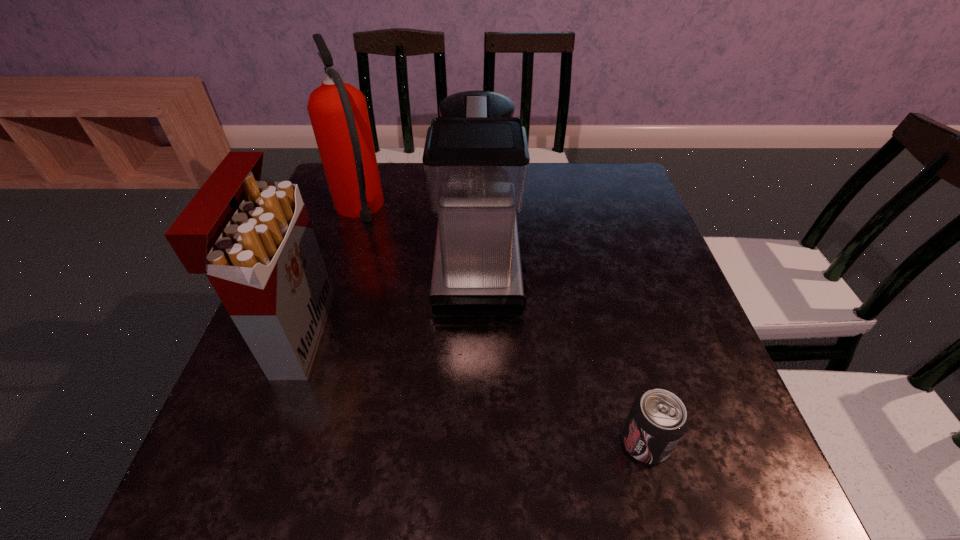
The height and width of the screenshot is (540, 960). In order to click on vacant space situated 0.230m on the left of the shortest object in this screenshot , I will do `click(485, 442)`.

I want to click on object located at the far edge, so click(338, 112).

You are a GUI agent. You are given a task and a screenshot of the screen. Output one action in this format:
    pyautogui.click(x=<x>, y=<y>)
    Task: Click on the object situated at the near edge
    
    Given the screenshot: What is the action you would take?
    pyautogui.click(x=657, y=420)

Locate an element on the screen. fire extinguisher at the left edge is located at coordinates [x=338, y=112].

You are a GUI agent. You are given a task and a screenshot of the screen. Output one action in this format:
    pyautogui.click(x=<x>, y=<y>)
    Task: Click on the cigarette case at the left edge
    This screenshot has width=960, height=540.
    Given the screenshot: What is the action you would take?
    pyautogui.click(x=254, y=240)

This screenshot has height=540, width=960. Identify the location of object that is at the right edge. (657, 420).

Locate an element on the screen. object positioned at the far left corner is located at coordinates (338, 112).

You are a GUI agent. You are given a task and a screenshot of the screen. Output one action in this format:
    pyautogui.click(x=<x>, y=<y>)
    Task: Click on the object positioned at the near right corner
    This screenshot has height=540, width=960.
    Given the screenshot: What is the action you would take?
    pyautogui.click(x=657, y=420)

Locate an element on the screen. The image size is (960, 540). free space at the far edge of the desktop is located at coordinates (576, 186).

Where is `blank space at the near edge of the desktop`? blank space at the near edge of the desktop is located at coordinates (398, 493).